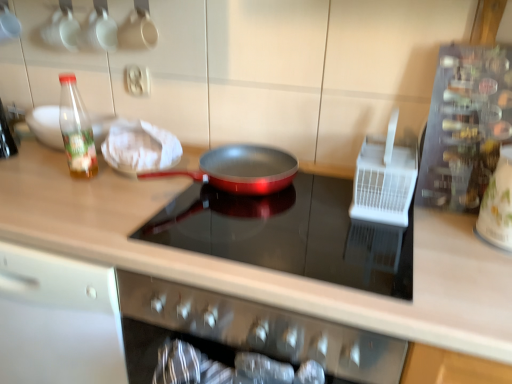
I want to click on vacant region in front of white cloth at upper left, so (x=105, y=198).